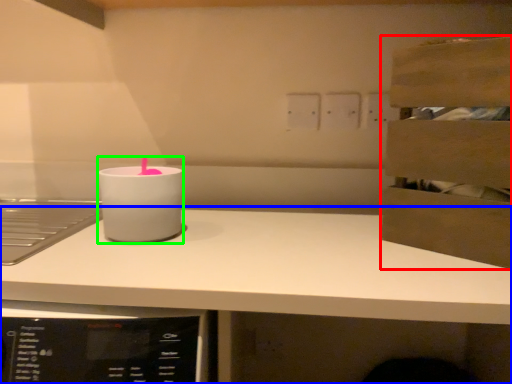
Question: Which object is positioned closest to cabinetry (highlighted by a red box)? Select from countertop (highlighted by a blue box) and candle holder (highlighted by a green box).

Choices:
 (A) countertop
 (B) candle holder

Answer: (A)